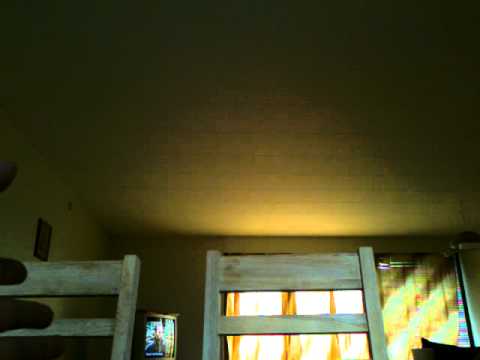
I want to click on chair back, so click(x=72, y=275), click(x=291, y=276).